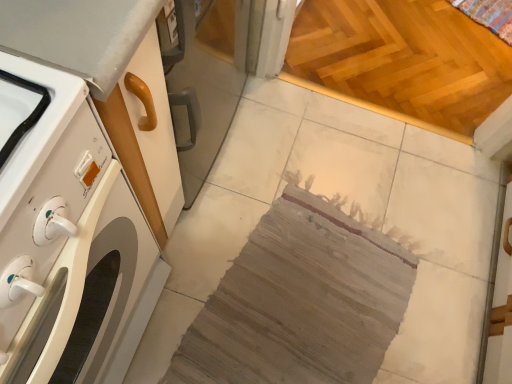
Question: Is light brown wooden floor at upper right closer to camera compared to white glossy washing machine at left?

Choices:
 (A) no
 (B) yes

Answer: (A)

Question: Is light brown wooden floor at upper right touching white glossy washing machine at left?

Choices:
 (A) yes
 (B) no

Answer: (B)

Question: Does light brown wooden floor at upper right come behind white glossy washing machine at left?

Choices:
 (A) no
 (B) yes

Answer: (B)

Question: Can you confirm if light brown wooden floor at upper right is positioned to the left of white glossy washing machine at left?

Choices:
 (A) no
 (B) yes

Answer: (A)

Question: Is light brown wooden floor at upper right not inside white glossy washing machine at left?

Choices:
 (A) yes
 (B) no

Answer: (A)

Question: Is light brown wooden floor at upper right facing away from white glossy washing machine at left?

Choices:
 (A) yes
 (B) no

Answer: (B)

Question: Is white glossy washing machine at left beside woven fabric rug at center?

Choices:
 (A) yes
 (B) no

Answer: (B)

Question: Does white glossy washing machine at left have a lesser width compared to woven fabric rug at center?

Choices:
 (A) yes
 (B) no

Answer: (A)

Question: Can you confirm if white glossy washing machine at left is wider than woven fabric rug at center?

Choices:
 (A) yes
 (B) no

Answer: (B)

Question: Is white glossy washing machine at left not within woven fabric rug at center?

Choices:
 (A) yes
 (B) no

Answer: (A)

Question: Can woven fabric rug at center be found inside white glossy washing machine at left?

Choices:
 (A) no
 (B) yes

Answer: (A)

Question: Considering the relative positions of white glossy washing machine at left and woven fabric rug at center in the image provided, is white glossy washing machine at left in front of woven fabric rug at center?

Choices:
 (A) no
 (B) yes

Answer: (B)

Question: Is light brown wooden floor at upper right positioned before woven fabric rug at center?

Choices:
 (A) no
 (B) yes

Answer: (A)